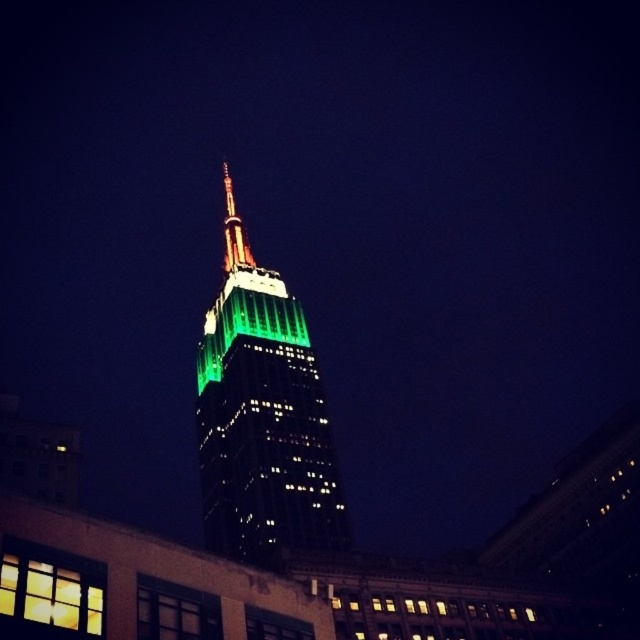
You are standing on a sidewalk in the city and see the green glass tower at center. If you want to take a photo of it from a distance of exactly 60 meters, should you move closer or farther away?

The green glass tower at center is currently 61.32 meters away. To achieve a distance of 60 meters, you should move closer to the tower by 1.32 meters.

You are standing in the city at night, looking at the Empire State Building. There are two points marked in the scene. The first point is at coordinates point (259,419) and the second is at point (240,250). If you want to take a photo that includes both points, which point should you focus on to ensure both are in sharp focus?

You should focus on point (240,250) because it is farther from the camera than point (259,419). By focusing on the farther point, the closer point will also be within the depth of field, ensuring both are in focus.